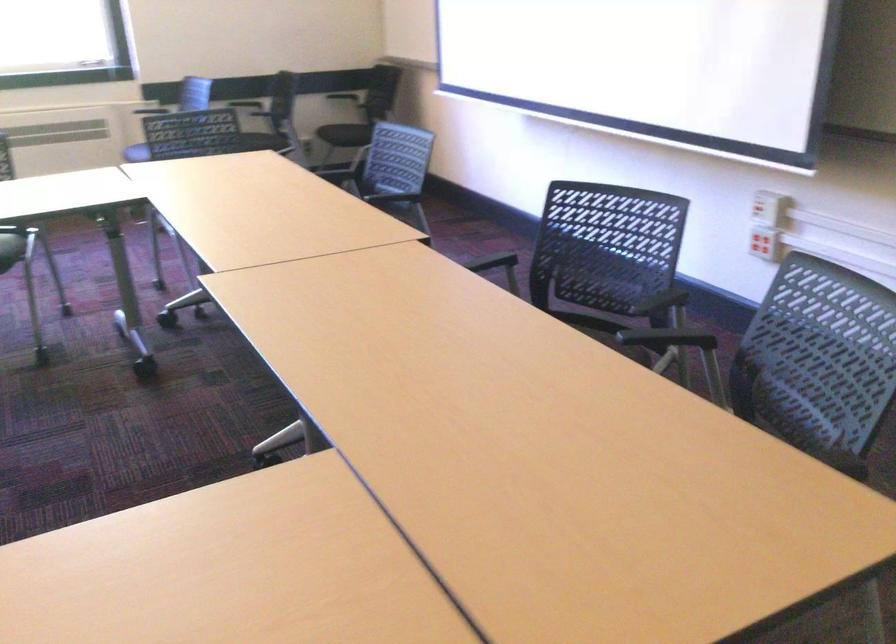
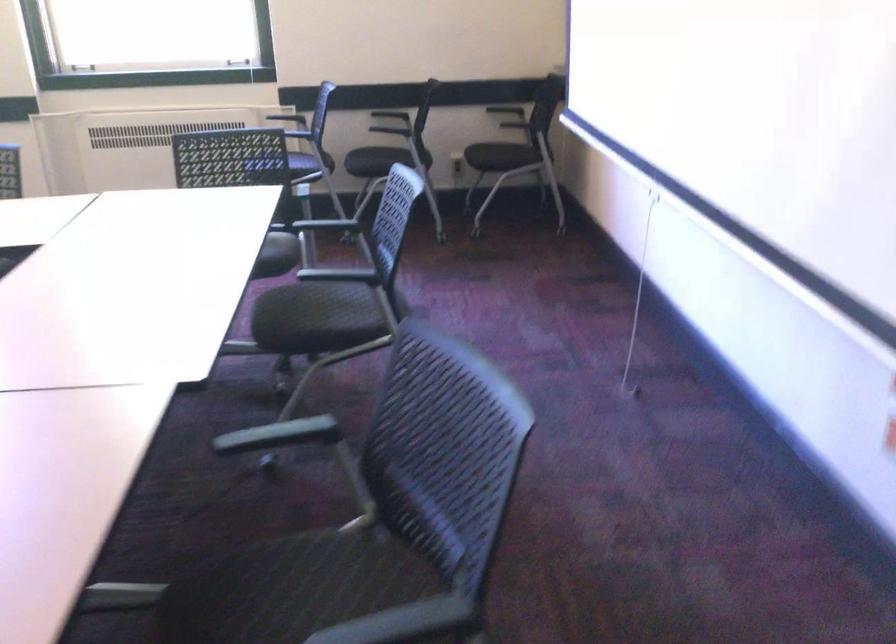
In the scene shown: In a continuous first-person perspective shot, in which direction is the camera moving?

The cameraman walked toward right, forward.